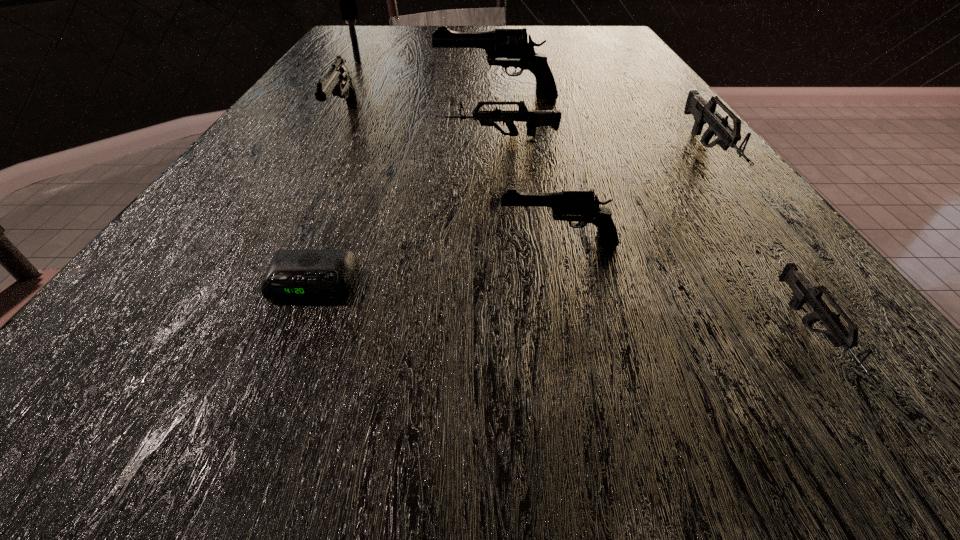
Find the location of a particular element. This screenshot has width=960, height=540. hairbrush is located at coordinates (347, 0).

Locate an element on the screen. the farthest object is located at coordinates (347, 0).

This screenshot has width=960, height=540. Find the location of `the second tallest object`. the second tallest object is located at coordinates (508, 48).

Image resolution: width=960 pixels, height=540 pixels. What are the coordinates of `the tallest gun` in the screenshot? It's located at (508, 48).

Image resolution: width=960 pixels, height=540 pixels. In order to click on the fifth shortest gun in this screenshot , I will do `click(338, 80)`.

You are a GUI agent. You are given a task and a screenshot of the screen. Output one action in this format:
    pyautogui.click(x=<x>, y=<y>)
    Task: Click on the sixth shortest object
    
    Given the screenshot: What is the action you would take?
    [338, 80]

Where is `the fifth farthest gun`? This screenshot has width=960, height=540. the fifth farthest gun is located at coordinates (580, 206).

Find the location of a particular element. The width and height of the screenshot is (960, 540). the nearest black gun is located at coordinates (580, 206).

The width and height of the screenshot is (960, 540). Find the location of `the biggest grey gun`. the biggest grey gun is located at coordinates (703, 112).

At what (x,y) coordinates should I click in order to perform the action: click on the rightmost gun. Please return your answer as a coordinate pair (x, y). Looking at the image, I should click on (703, 112).